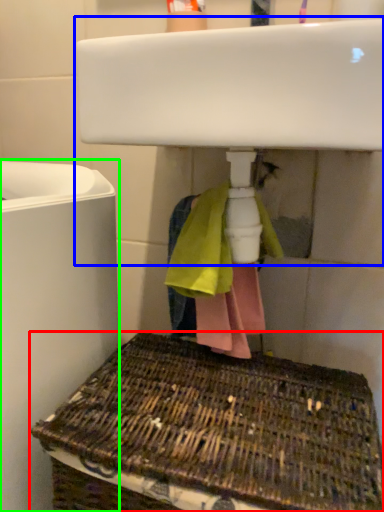
Question: Based on their relative distances, which object is nearer to basket (highlighted by a red box)? Choose from sink (highlighted by a blue box) and appliance (highlighted by a green box).

Choices:
 (A) sink
 (B) appliance

Answer: (B)